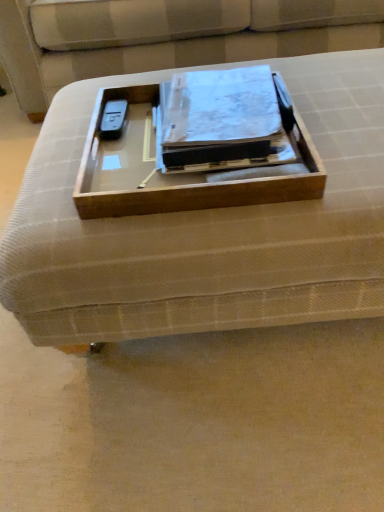
Question: Is wooden tray at center taller or shorter than beige fabric couch at center?

Choices:
 (A) tall
 (B) short

Answer: (B)

Question: Is point (117, 184) positioned closer to the camera than point (130, 45)?

Choices:
 (A) closer
 (B) farther

Answer: (A)

Question: Which object is the farthest from the wooden tray at center?

Choices:
 (A) beige fabric couch at center
 (B) matte plastic binder at center
 (C) wooden tray at center

Answer: (A)

Question: Which object is the closest to the beige fabric couch at center?

Choices:
 (A) wooden tray at center
 (B) wooden tray at center
 (C) matte plastic binder at center

Answer: (C)